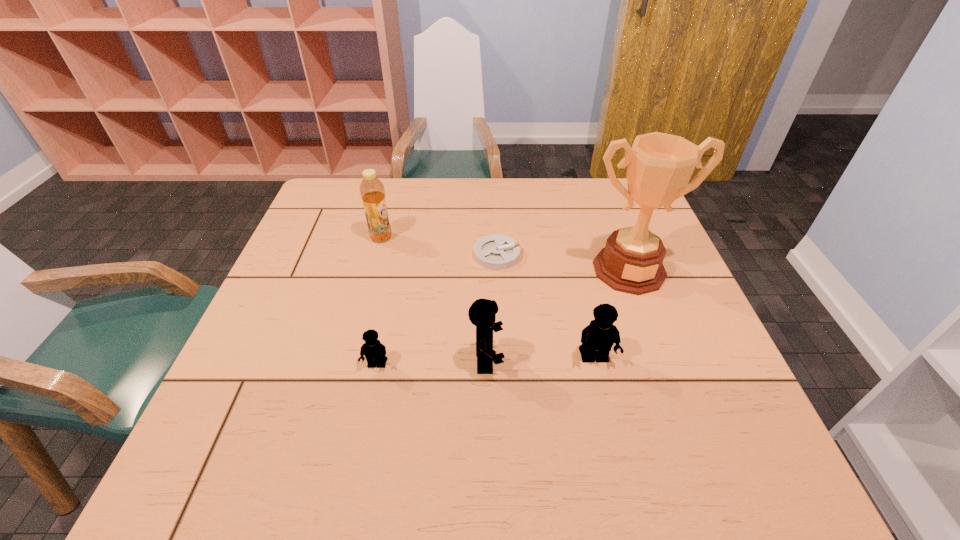
Locate an element on the screen. vacant space located on the front-facing side of the second Lego from left to right is located at coordinates (588, 361).

I want to click on vacant area situated 0.130m on the front-facing side of the rightmost Lego, so click(611, 428).

This screenshot has height=540, width=960. I want to click on vacant space located on the front of the second tallest object, so click(365, 299).

Image resolution: width=960 pixels, height=540 pixels. Identify the location of free spot located on the front-facing side of the award. point(666,371).

Identify the location of free region located on the left of the shortest object. This screenshot has width=960, height=540. (455, 255).

In order to click on object located at the right edge in this screenshot , I will do `click(660, 165)`.

What are the coordinates of `free space at the far edge of the desktop` in the screenshot? It's located at (446, 181).

You are a GUI agent. You are given a task and a screenshot of the screen. Output one action in this format:
    pyautogui.click(x=<x>, y=<y>)
    Task: Click on the blank space at the near edge of the desktop
    This screenshot has height=540, width=960.
    Given the screenshot: What is the action you would take?
    pyautogui.click(x=352, y=396)

Find the location of `vacant area at the left edge of the desktop`. vacant area at the left edge of the desktop is located at coordinates (316, 234).

Locate an element on the screen. Image resolution: width=960 pixels, height=540 pixels. blank area at the right edge is located at coordinates (662, 316).